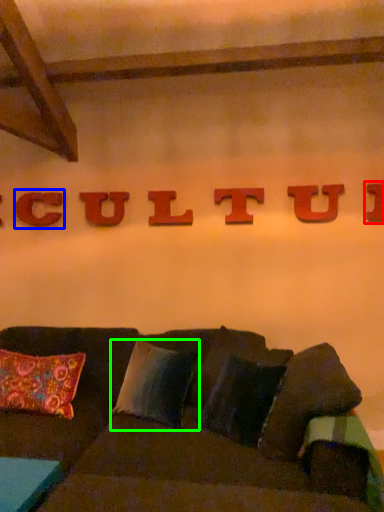
Question: Which object is the closest to the letter (highlighted by a red box)? Choose among these: letter (highlighted by a blue box) or pillow (highlighted by a green box).

Choices:
 (A) letter
 (B) pillow

Answer: (B)